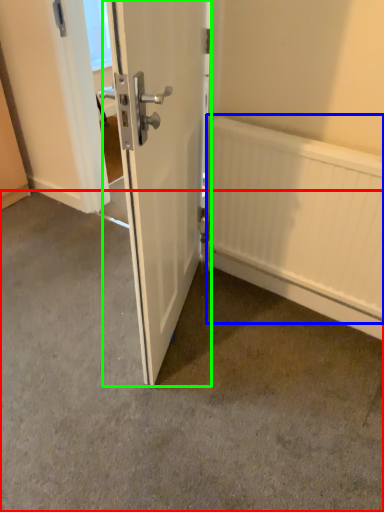
Question: Considering the real-world distances, which object is farthest from concrete (highlighted by a red box)? radiator (highlighted by a blue box) or door (highlighted by a green box)?

Choices:
 (A) radiator
 (B) door

Answer: (A)